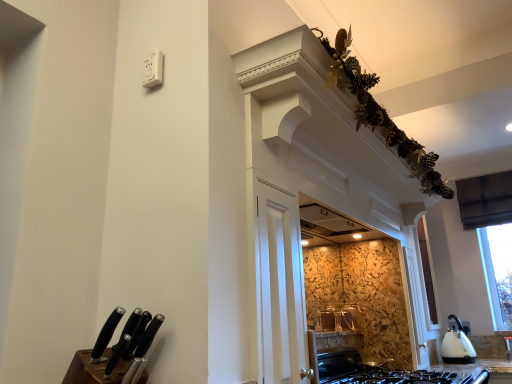
Question: Considering the positions of brown wooden knife block at lower left and white glossy electric kettle at lower right in the image, is brown wooden knife block at lower left taller or shorter than white glossy electric kettle at lower right?

Choices:
 (A) short
 (B) tall

Answer: (A)

Question: Looking at the image, does brown wooden knife block at lower left seem bigger or smaller compared to white glossy electric kettle at lower right?

Choices:
 (A) big
 (B) small

Answer: (B)

Question: Which of these objects is positioned farthest from the black matte knife at lower left, acting as the first knife starting from the right?

Choices:
 (A) brown wooden knife block at lower left
 (B) white glossy electric kettle at lower right
 (C) black matte gas stove at lower center
 (D) black plastic knife at lower left, placed as the 1th knife when sorted from left to right

Answer: (B)

Question: Which object is positioned farthest from the brown wooden knife block at lower left?

Choices:
 (A) black plastic knife at lower left, which is the 2th knife from right to left
 (B) black matte gas stove at lower center
 (C) black matte knife at lower left, acting as the first knife starting from the right
 (D) white glossy electric kettle at lower right

Answer: (D)